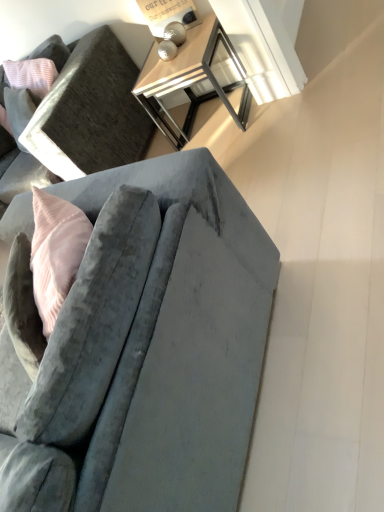
Where is `vacant space to the right of velvet gray couch at center, the first studio couch when ordered from front to back`? The width and height of the screenshot is (384, 512). vacant space to the right of velvet gray couch at center, the first studio couch when ordered from front to back is located at coordinates (308, 220).